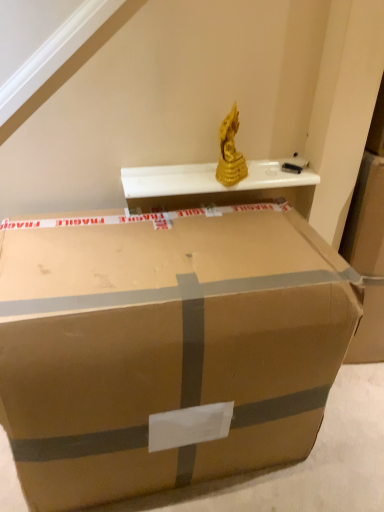
At what (x,y) coordinates should I click in order to perform the action: click on vacant point above white glossy shelf at upper center (from a real-world perspective). Please return your answer as a coordinate pair (x, y). The width and height of the screenshot is (384, 512). Looking at the image, I should click on (192, 170).